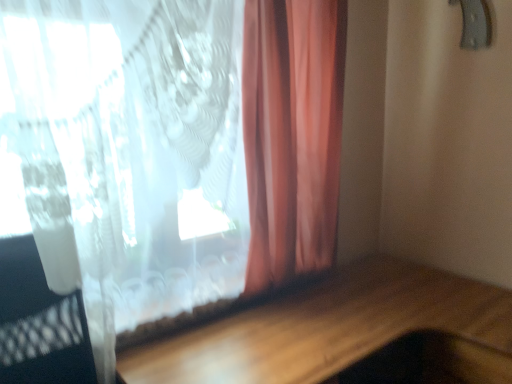
Question: From a real-world perspective, relative to wooden table at lower center, is metallic gray door handle at upper right vertically above or below?

Choices:
 (A) below
 (B) above

Answer: (B)

Question: In terms of width, does metallic gray door handle at upper right look wider or thinner when compared to wooden table at lower center?

Choices:
 (A) wide
 (B) thin

Answer: (B)

Question: Based on their relative distances, which object is farther from the metallic gray door handle at upper right?

Choices:
 (A) wooden table at lower center
 (B) translucent fabric curtain at upper left

Answer: (A)

Question: Estimate the real-world distances between objects in this image. Which object is closer to the wooden table at lower center?

Choices:
 (A) metallic gray door handle at upper right
 (B) translucent fabric curtain at upper left

Answer: (B)